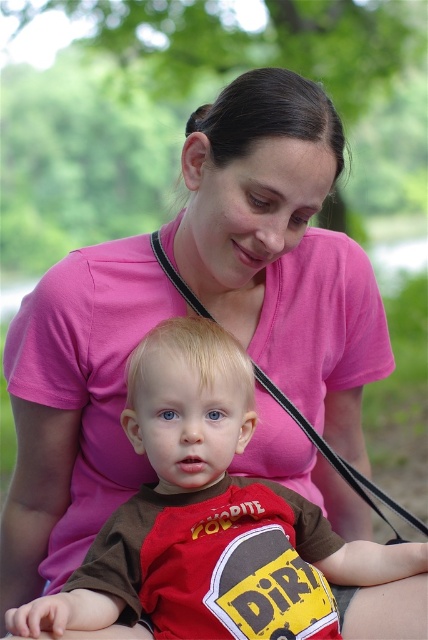
Which is more to the right, brown cotton shirt at center or black leather strap at center?

black leather strap at center

Which is more to the left, brown cotton shirt at center or black leather strap at center?

Positioned to the left is brown cotton shirt at center.

What are the coordinates of `brown cotton shirt at center` in the screenshot? It's located at (195, 509).